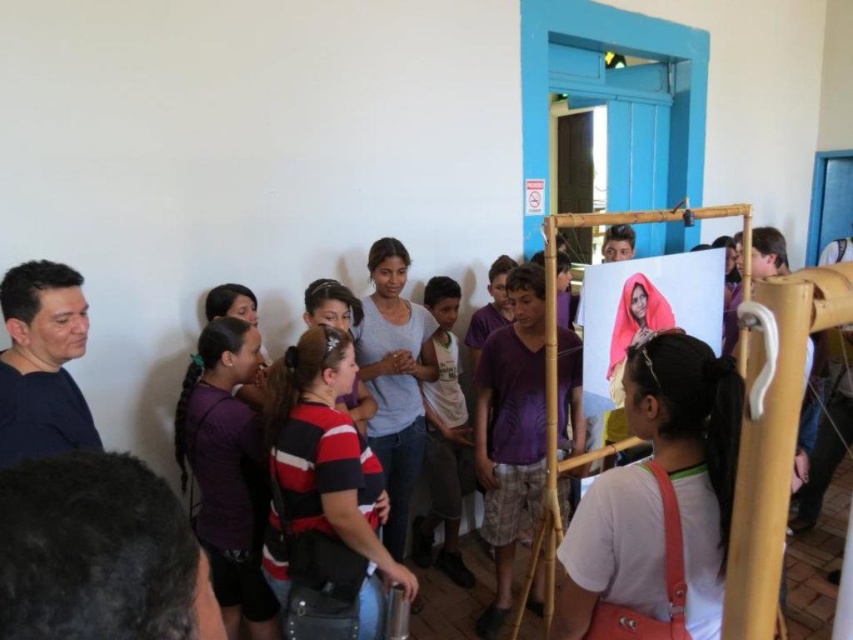
You are standing in the room and see the point marked at coordinates (323, 484). Based on the scene description, what object or part of the scene is this point most likely located on?

The point at coordinates (323, 484) is on the striped fabric shirt at center.

You are organizing a small event and need to decide which item can be used as a backdrop. The white fabric at center and the white cotton shirt at center are both available. Based on their sizes, which one would be more suitable for a backdrop?

The white cotton shirt at center is larger than the white fabric at center, so it would be more suitable as a backdrop since it can cover a larger area.

You are standing in the room and want to see both the striped fabric shirt at center and the purple fabric shirt at lower left clearly. Which one will appear taller in the photo?

The striped fabric shirt at center is not as tall as the purple fabric shirt at lower left, so the purple fabric shirt at lower left will appear taller in the photo.